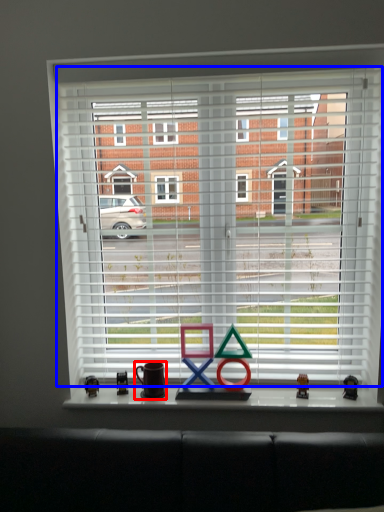
Question: Which object is further to the camera taking this photo, mug (highlighted by a red box) or window blind (highlighted by a blue box)?

Choices:
 (A) mug
 (B) window blind

Answer: (A)